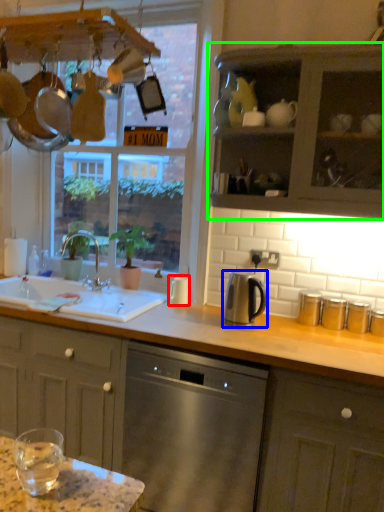
Question: Which is farther away from appliance (highlighted by a red box)? kitchen appliance (highlighted by a blue box) or cabinetry (highlighted by a green box)?

Choices:
 (A) kitchen appliance
 (B) cabinetry

Answer: (B)